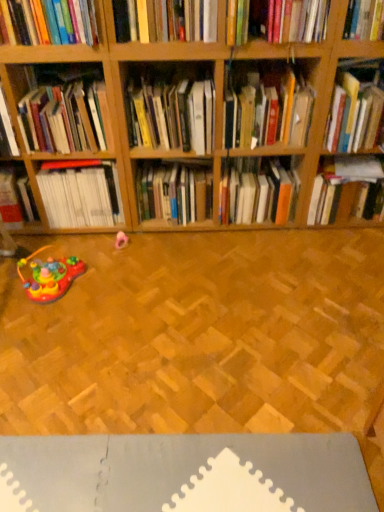
Where is `vacant space situated above gray foam mat at lower center (from a real-world perspective)`? This screenshot has width=384, height=512. vacant space situated above gray foam mat at lower center (from a real-world perspective) is located at coordinates (195, 471).